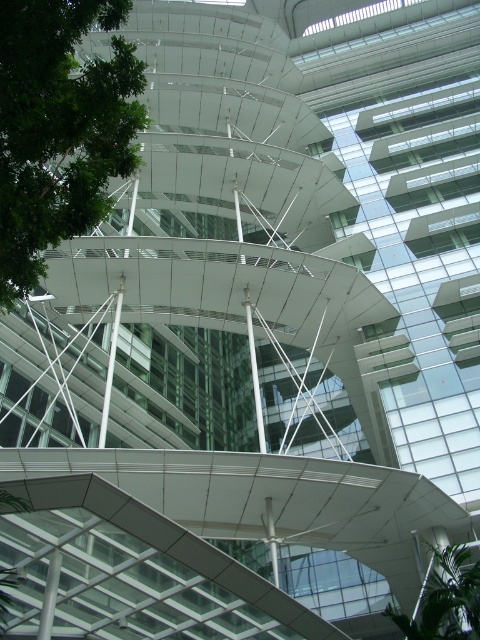
Question: Does green leafy tree at upper left appear on the right side of green leafy tree at lower right?

Choices:
 (A) yes
 (B) no

Answer: (B)

Question: Does green leafy tree at upper left appear on the left side of green leafy tree at lower right?

Choices:
 (A) yes
 (B) no

Answer: (A)

Question: Where is green leafy tree at upper left located in relation to green leafy tree at lower right in the image?

Choices:
 (A) above
 (B) below

Answer: (A)

Question: Which point is closer to the camera?

Choices:
 (A) green leafy tree at lower right
 (B) green leafy tree at upper left

Answer: (B)

Question: Which of the following is the farthest from the observer?

Choices:
 (A) (15, 273)
 (B) (451, 627)

Answer: (B)

Question: Among these objects, which one is farthest from the camera?

Choices:
 (A) green leafy tree at upper left
 (B) green leafy tree at lower right

Answer: (B)